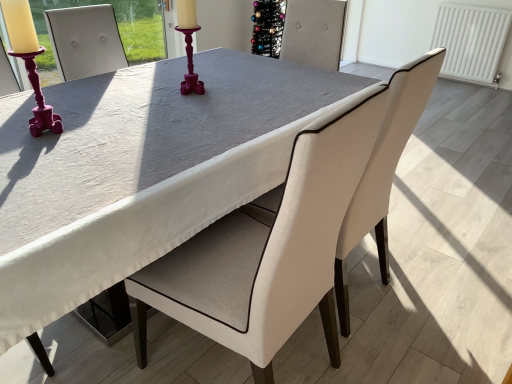
Question: From a real-world perspective, is white fabric chair at center, positioned as the first chair in left-to-right order, physically located above or below matte pink candlestick at left?

Choices:
 (A) above
 (B) below

Answer: (B)

Question: Considering their positions, is white fabric chair at center, which is the 2th chair from right to left, located in front of or behind matte pink candlestick at left?

Choices:
 (A) front
 (B) behind

Answer: (A)

Question: Which of these objects is positioned closest to the matte pink candlestick at left?

Choices:
 (A) white fabric chair at center, positioned as the first chair in left-to-right order
 (B) white fabric chair at center, the first chair viewed from the right

Answer: (A)

Question: Which of these objects is positioned closest to the matte pink candlestick at left?

Choices:
 (A) white fabric chair at center, the first chair viewed from the right
 (B) white fabric chair at center, which is the 2th chair from right to left

Answer: (B)